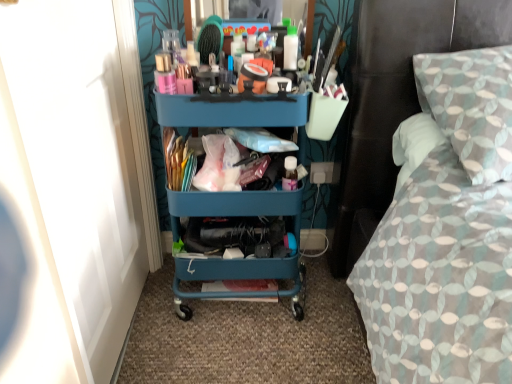
Question: Is textured fabric bed at right wider than white plastic power outlet at lower right?

Choices:
 (A) no
 (B) yes

Answer: (B)

Question: Is textured fabric bed at right oriented towards white plastic power outlet at lower right?

Choices:
 (A) yes
 (B) no

Answer: (B)

Question: Does textured fabric bed at right have a lesser height compared to white plastic power outlet at lower right?

Choices:
 (A) no
 (B) yes

Answer: (A)

Question: Is textured fabric bed at right to the right of white plastic power outlet at lower right from the viewer's perspective?

Choices:
 (A) yes
 (B) no

Answer: (A)

Question: Is textured fabric bed at right taller than white plastic power outlet at lower right?

Choices:
 (A) no
 (B) yes

Answer: (B)

Question: Considering their positions, is textured fabric bed at right located in front of or behind teal plastic cart at center?

Choices:
 (A) front
 (B) behind

Answer: (A)

Question: Do you think textured fabric bed at right is within teal plastic cart at center, or outside of it?

Choices:
 (A) outside
 (B) inside

Answer: (A)

Question: From the image's perspective, relative to teal plastic cart at center, is textured fabric bed at right above or below?

Choices:
 (A) below
 (B) above

Answer: (B)

Question: Is textured fabric bed at right wider or thinner than teal plastic cart at center?

Choices:
 (A) thin
 (B) wide

Answer: (B)

Question: In terms of width, does white plastic power outlet at lower right look wider or thinner when compared to textured fabric bed at right?

Choices:
 (A) thin
 (B) wide

Answer: (A)

Question: Is white plastic power outlet at lower right in front of or behind textured fabric bed at right in the image?

Choices:
 (A) front
 (B) behind

Answer: (B)

Question: Is point (332, 162) closer or farther from the camera than point (437, 210)?

Choices:
 (A) closer
 (B) farther

Answer: (B)

Question: Considering the relative positions of white plastic power outlet at lower right and textured fabric bed at right in the image provided, is white plastic power outlet at lower right to the left or to the right of textured fabric bed at right?

Choices:
 (A) right
 (B) left

Answer: (B)

Question: From a real-world perspective, relative to white plastic power outlet at lower right, is textured fabric bed at right vertically above or below?

Choices:
 (A) above
 (B) below

Answer: (A)

Question: Is point (465, 74) closer or farther from the camera than point (331, 175)?

Choices:
 (A) closer
 (B) farther

Answer: (A)